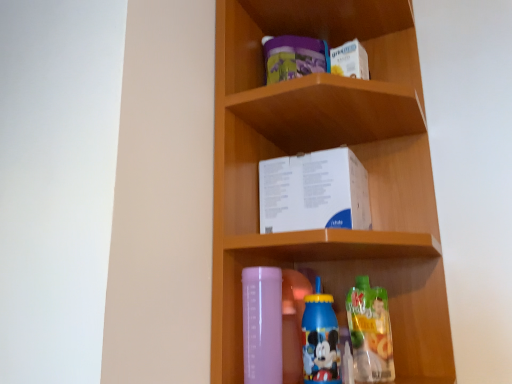
The image size is (512, 384). Identify the location of transparent plastic bottle at lower center, marked as the third bottle in a right-to-left arrangement. (262, 325).

This screenshot has height=384, width=512. Describe the element at coordinates (320, 341) in the screenshot. I see `blue plastic bottle at lower center, which appears as the second bottle when viewed from the left` at that location.

This screenshot has height=384, width=512. I want to click on matte plastic box at center, so [322, 149].

What do you see at coordinates (370, 332) in the screenshot? This screenshot has height=384, width=512. I see `translucent plastic juice at lower right, which is the third bottle in left-to-right order` at bounding box center [370, 332].

Identify the location of white paper box at center. The image size is (512, 384). (314, 192).

Is translucent plastic juice at lower right, which is the third bottle in left-to-right order, beside transparent plastic bottle at lower center, marked as the third bottle in a right-to-left arrangement?

No, translucent plastic juice at lower right, which is the third bottle in left-to-right order, is not making contact with transparent plastic bottle at lower center, marked as the third bottle in a right-to-left arrangement.

Which object is further away from the camera taking this photo, translucent plastic juice at lower right, which is the third bottle in left-to-right order, or transparent plastic bottle at lower center, marked as the third bottle in a right-to-left arrangement?

translucent plastic juice at lower right, which is the third bottle in left-to-right order, is more distant.

Measure the distance from translucent plastic juice at lower right, which is the 1th bottle from right to left, to transparent plastic bottle at lower center, marked as the third bottle in a right-to-left arrangement.

The distance of translucent plastic juice at lower right, which is the 1th bottle from right to left, from transparent plastic bottle at lower center, marked as the third bottle in a right-to-left arrangement, is 7.05 inches.

Are white paper box at center and blue plastic bottle at lower center, which appears as the second bottle when viewed from the left, located far from each other?

No, there isn't a large distance between white paper box at center and blue plastic bottle at lower center, which appears as the second bottle when viewed from the left.

Is blue plastic bottle at lower center, the second bottle in the right-to-left sequence, a part of white paper box at center?

No, white paper box at center does not contain blue plastic bottle at lower center, the second bottle in the right-to-left sequence.

Which is behind, point (336, 200) or point (322, 317)?

Positioned behind is point (336, 200).

From a real-world perspective, who is located lower, white paper box at center or blue plastic bottle at lower center, which appears as the second bottle when viewed from the left?

blue plastic bottle at lower center, which appears as the second bottle when viewed from the left, is physically lower.

Locate an element on the screen. bottle that is the 3rd one when counting downward from the white paper box at center (from the image's perspective) is located at coordinates (370, 332).

Considering the positions of point (335, 197) and point (388, 367), is point (335, 197) closer or farther from the camera than point (388, 367)?

Point (335, 197) is farther from the camera than point (388, 367).

Considering the positions of objects white paper box at center and translucent plastic juice at lower right, which is the third bottle in left-to-right order, in the image provided, who is more to the right, white paper box at center or translucent plastic juice at lower right, which is the third bottle in left-to-right order,?

Positioned to the right is translucent plastic juice at lower right, which is the third bottle in left-to-right order.

Consider the image. Considering the relative positions of white paper box at center and translucent plastic juice at lower right, which is the third bottle in left-to-right order, in the image provided, is white paper box at center in front of translucent plastic juice at lower right, which is the third bottle in left-to-right order,?

Yes, white paper box at center is in front of translucent plastic juice at lower right, which is the third bottle in left-to-right order.

Does point (246, 31) come farther from viewer compared to point (315, 295)?

That is True.

Is matte plastic box at center taller or shorter than blue plastic bottle at lower center, which appears as the second bottle when viewed from the left?

Considering their sizes, matte plastic box at center has more height than blue plastic bottle at lower center, which appears as the second bottle when viewed from the left.

Is blue plastic bottle at lower center, which appears as the second bottle when viewed from the left, completely or partially inside matte plastic box at center?

That's correct, blue plastic bottle at lower center, which appears as the second bottle when viewed from the left, is inside matte plastic box at center.

Is matte plastic box at center positioned with its back to blue plastic bottle at lower center, the second bottle in the right-to-left sequence?

That's right, matte plastic box at center is facing away from blue plastic bottle at lower center, the second bottle in the right-to-left sequence.

From a real-world perspective, is translucent plastic juice at lower right, which is the third bottle in left-to-right order, over blue plastic bottle at lower center, which appears as the second bottle when viewed from the left?

Actually, translucent plastic juice at lower right, which is the third bottle in left-to-right order, is physically below blue plastic bottle at lower center, which appears as the second bottle when viewed from the left, in the real world.

From the picture: Is translucent plastic juice at lower right, which is the 1th bottle from right to left, completely or partially outside of blue plastic bottle at lower center, the second bottle in the right-to-left sequence?

translucent plastic juice at lower right, which is the 1th bottle from right to left, is positioned outside blue plastic bottle at lower center, the second bottle in the right-to-left sequence.

Could you measure the distance between translucent plastic juice at lower right, which is the third bottle in left-to-right order, and blue plastic bottle at lower center, the second bottle in the right-to-left sequence?

The distance of translucent plastic juice at lower right, which is the third bottle in left-to-right order, from blue plastic bottle at lower center, the second bottle in the right-to-left sequence, is 3.34 inches.

Is translucent plastic juice at lower right, which is the 1th bottle from right to left, positioned before blue plastic bottle at lower center, the second bottle in the right-to-left sequence?

No.

Does blue plastic bottle at lower center, which appears as the second bottle when viewed from the left, have a greater height compared to white paper box at center?

Yes.

Is blue plastic bottle at lower center, which appears as the second bottle when viewed from the left, facing away from white paper box at center?

blue plastic bottle at lower center, which appears as the second bottle when viewed from the left, does not have its back to white paper box at center.

Identify the location of book lying behind the blue plastic bottle at lower center, the second bottle in the right-to-left sequence. tap(314, 192).

Would you say blue plastic bottle at lower center, the second bottle in the right-to-left sequence, contains white paper box at center?

That's incorrect, white paper box at center is not inside blue plastic bottle at lower center, the second bottle in the right-to-left sequence.

From a real-world perspective, is blue plastic bottle at lower center, which appears as the second bottle when viewed from the left, above or below translucent plastic juice at lower right, which is the 1th bottle from right to left?

From a real-world perspective, blue plastic bottle at lower center, which appears as the second bottle when viewed from the left, is physically above translucent plastic juice at lower right, which is the 1th bottle from right to left.

Is blue plastic bottle at lower center, the second bottle in the right-to-left sequence, located outside translucent plastic juice at lower right, which is the third bottle in left-to-right order?

That's correct, blue plastic bottle at lower center, the second bottle in the right-to-left sequence, is outside of translucent plastic juice at lower right, which is the third bottle in left-to-right order.

How many degrees apart are the facing directions of blue plastic bottle at lower center, which appears as the second bottle when viewed from the left, and translucent plastic juice at lower right, which is the third bottle in left-to-right order?

The angle between the facing direction of blue plastic bottle at lower center, which appears as the second bottle when viewed from the left, and the facing direction of translucent plastic juice at lower right, which is the third bottle in left-to-right order, is 0 degrees.

This screenshot has width=512, height=384. I want to click on the 2nd bottle counting from the right of the transparent plastic bottle at lower center, which is the 1th bottle from left to right, so click(370, 332).

You are a GUI agent. You are given a task and a screenshot of the screen. Output one action in this format:
    pyautogui.click(x=<x>, y=<y>)
    Task: Click on the 2nd bottle in front when counting from the white paper box at center
    Image resolution: width=512 pixels, height=384 pixels.
    Given the screenshot: What is the action you would take?
    pyautogui.click(x=320, y=341)

Considering their positions, is matte plastic box at center positioned closer to blue plastic bottle at lower center, which appears as the second bottle when viewed from the left, than white paper box at center?

Among the two, white paper box at center is located nearer to blue plastic bottle at lower center, which appears as the second bottle when viewed from the left.

From the image, which object appears to be nearer to translucent plastic juice at lower right, which is the 1th bottle from right to left, white paper box at center or blue plastic bottle at lower center, which appears as the second bottle when viewed from the left?

blue plastic bottle at lower center, which appears as the second bottle when viewed from the left, lies closer to translucent plastic juice at lower right, which is the 1th bottle from right to left, than the other object.

In the scene shown: Based on their spatial positions, is matte plastic box at center or translucent plastic juice at lower right, which is the third bottle in left-to-right order, closer to blue plastic bottle at lower center, which appears as the second bottle when viewed from the left?

translucent plastic juice at lower right, which is the third bottle in left-to-right order.

Considering their positions, is blue plastic bottle at lower center, the second bottle in the right-to-left sequence, positioned closer to translucent plastic juice at lower right, which is the 1th bottle from right to left, than matte plastic box at center?

blue plastic bottle at lower center, the second bottle in the right-to-left sequence, is closer to translucent plastic juice at lower right, which is the 1th bottle from right to left.

When comparing their distances from blue plastic bottle at lower center, the second bottle in the right-to-left sequence, does translucent plastic juice at lower right, which is the 1th bottle from right to left, or white paper box at center seem closer?

translucent plastic juice at lower right, which is the 1th bottle from right to left.

Based on the photo, considering their positions, is blue plastic bottle at lower center, the second bottle in the right-to-left sequence, positioned further to matte plastic box at center than translucent plastic juice at lower right, which is the third bottle in left-to-right order?

Among the two, blue plastic bottle at lower center, the second bottle in the right-to-left sequence, is located further to matte plastic box at center.

Looking at the image, which one is located closer to blue plastic bottle at lower center, which appears as the second bottle when viewed from the left, transparent plastic bottle at lower center, marked as the third bottle in a right-to-left arrangement, or translucent plastic juice at lower right, which is the third bottle in left-to-right order?

Based on the image, transparent plastic bottle at lower center, marked as the third bottle in a right-to-left arrangement, appears to be nearer to blue plastic bottle at lower center, which appears as the second bottle when viewed from the left.

Estimate the real-world distances between objects in this image. Which object is further from white paper box at center, transparent plastic bottle at lower center, which is the 1th bottle from left to right, or blue plastic bottle at lower center, which appears as the second bottle when viewed from the left?

Based on the image, blue plastic bottle at lower center, which appears as the second bottle when viewed from the left, appears to be further to white paper box at center.

Where is `book between matte plastic box at center and blue plastic bottle at lower center, the second bottle in the right-to-left sequence, in the vertical direction`? book between matte plastic box at center and blue plastic bottle at lower center, the second bottle in the right-to-left sequence, in the vertical direction is located at coordinates (314, 192).

Locate an element on the screen. The image size is (512, 384). bottle situated between transparent plastic bottle at lower center, which is the 1th bottle from left to right, and translucent plastic juice at lower right, which is the 1th bottle from right to left, from left to right is located at coordinates (320, 341).

Where is `bottle that lies between white paper box at center and transparent plastic bottle at lower center, which is the 1th bottle from left to right, from top to bottom`? The image size is (512, 384). bottle that lies between white paper box at center and transparent plastic bottle at lower center, which is the 1th bottle from left to right, from top to bottom is located at coordinates (320, 341).

This screenshot has width=512, height=384. What are the coordinates of `bottle between matte plastic box at center and transparent plastic bottle at lower center, which is the 1th bottle from left to right, in the vertical direction` in the screenshot? It's located at (320, 341).